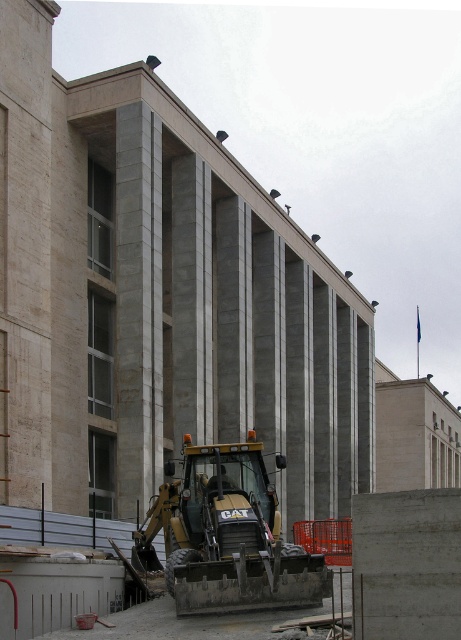
I want to click on concrete/plain at lower right, so click(407, 564).

Does point (424, 532) come in front of point (211, 486)?

Yes, it is in front of point (211, 486).

Image resolution: width=461 pixels, height=640 pixels. I want to click on concrete/plain at lower right, so click(x=407, y=564).

Does gold metallic excavator at center have a smaller size compared to concrete/plain at lower right?

No.

Does gold metallic excavator at center appear on the right side of concrete/plain at lower right?

Incorrect, gold metallic excavator at center is not on the right side of concrete/plain at lower right.

Between point (188, 525) and point (457, 499), which one is positioned behind?

The point (188, 525) is behind.

Image resolution: width=461 pixels, height=640 pixels. Find the location of `gold metallic excavator at center`. gold metallic excavator at center is located at coordinates (226, 538).

Does gold metallic excavator at center have a larger size compared to metallic helmet at center?

Indeed, gold metallic excavator at center has a larger size compared to metallic helmet at center.

Does gold metallic excavator at center come in front of metallic helmet at center?

Yes, gold metallic excavator at center is in front of metallic helmet at center.

Which is behind, point (152, 531) or point (212, 480)?

Positioned behind is point (152, 531).

The height and width of the screenshot is (640, 461). Identify the location of gold metallic excavator at center. (226, 538).